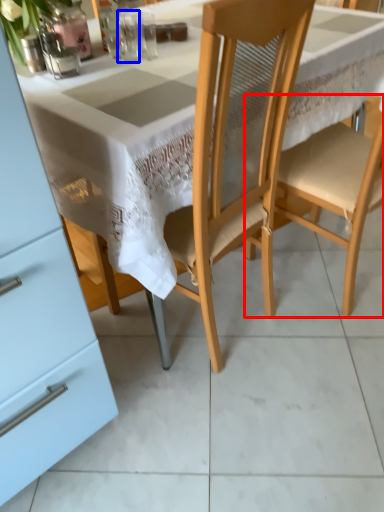
Question: Which of the following is the closest to the observer, chair (highlighted by a red box) or tableware (highlighted by a blue box)?

Choices:
 (A) chair
 (B) tableware

Answer: (A)